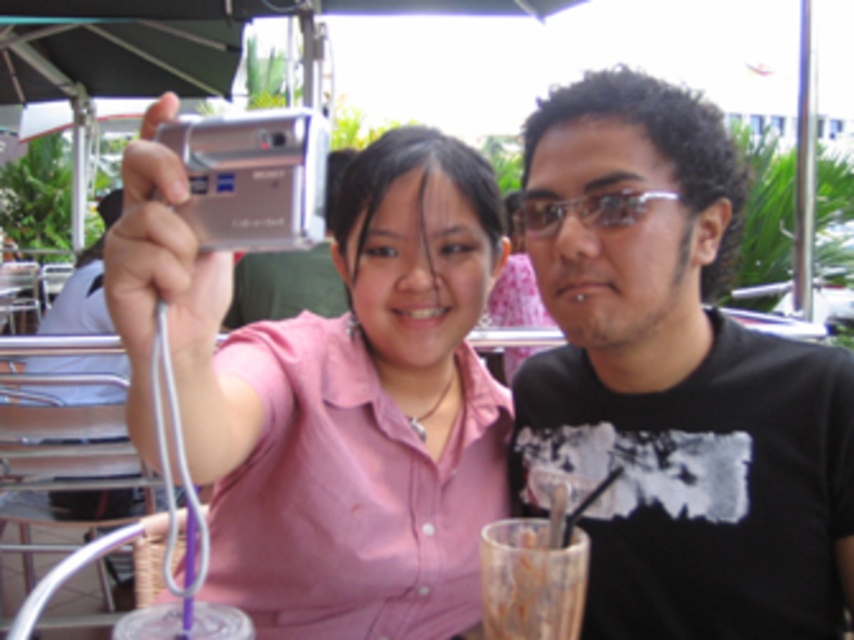
Which of these two, black matte shirt at right or silver metallic camera at upper left, stands shorter?

black matte shirt at right is shorter.

Which is behind, point (736, 333) or point (264, 572)?

The point (264, 572) is more distant.

Between point (656, 134) and point (422, 285), which one is positioned behind?

The point (422, 285) is more distant.

The width and height of the screenshot is (854, 640). What are the coordinates of `black matte shirt at right` in the screenshot? It's located at (674, 381).

Can you confirm if translucent glass cup at lower center is thinner than transparent plastic glasses at center?

Indeed, translucent glass cup at lower center has a lesser width compared to transparent plastic glasses at center.

Who is lower down, translucent glass cup at lower center or transparent plastic glasses at center?

Positioned lower is translucent glass cup at lower center.

Is point (566, 584) closer to camera compared to point (531, 227)?

That is True.

Identify the location of translucent glass cup at lower center. (531, 580).

Is black matte shirt at right smaller than translucent glass cup at lower center?

Incorrect, black matte shirt at right is not smaller in size than translucent glass cup at lower center.

Does black matte shirt at right have a greater height compared to translucent glass cup at lower center?

Yes.

Measure the distance between point (794, 488) and camera.

1.10 meters

Identify the location of black matte shirt at right. (674, 381).